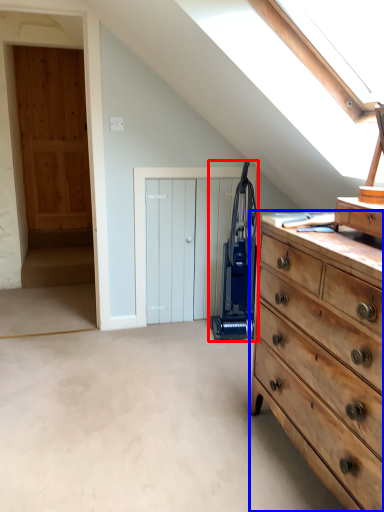
Question: Among these objects, which one is farthest to the camera, appliance (highlighted by a red box) or chest of drawers (highlighted by a blue box)?

Choices:
 (A) appliance
 (B) chest of drawers

Answer: (A)